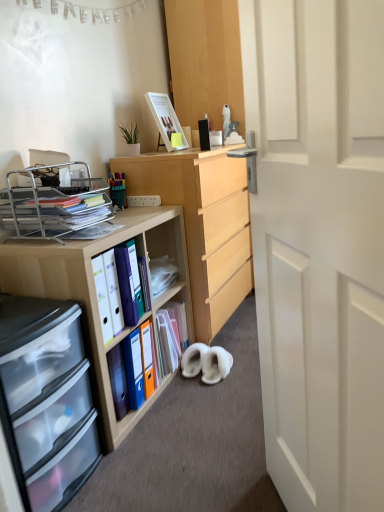
This screenshot has height=512, width=384. Identify the location of vacant space to the right of white fluffy slippers at lower center, acting as the 2th footwear starting from the left. point(243,371).